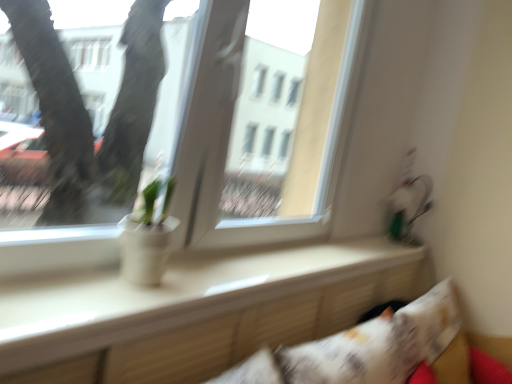
Question: Can you confirm if white matte pot at center is shorter than transparent glass window at center?

Choices:
 (A) yes
 (B) no

Answer: (A)

Question: Considering the relative sizes of white matte pot at center and transparent glass window at center in the image provided, is white matte pot at center wider than transparent glass window at center?

Choices:
 (A) no
 (B) yes

Answer: (A)

Question: Is white matte pot at center placed right next to transparent glass window at center?

Choices:
 (A) yes
 (B) no

Answer: (B)

Question: Is white matte pot at center at the left side of transparent glass window at center?

Choices:
 (A) no
 (B) yes

Answer: (B)

Question: Is white matte pot at center to the right of transparent glass window at center from the viewer's perspective?

Choices:
 (A) yes
 (B) no

Answer: (B)

Question: Can you confirm if white matte pot at center is taller than transparent glass window at center?

Choices:
 (A) yes
 (B) no

Answer: (B)

Question: Would you say white matte pot at center is outside white glossy window sill at center?

Choices:
 (A) no
 (B) yes

Answer: (B)

Question: Considering the relative positions of white matte pot at center and white glossy window sill at center in the image provided, is white matte pot at center behind white glossy window sill at center?

Choices:
 (A) yes
 (B) no

Answer: (A)

Question: Considering the relative sizes of white matte pot at center and white glossy window sill at center in the image provided, is white matte pot at center smaller than white glossy window sill at center?

Choices:
 (A) yes
 (B) no

Answer: (A)

Question: From a real-world perspective, is white matte pot at center beneath white glossy window sill at center?

Choices:
 (A) yes
 (B) no

Answer: (B)

Question: Would you say white glossy window sill at center is part of white matte pot at center's contents?

Choices:
 (A) no
 (B) yes

Answer: (A)

Question: From the image's perspective, is white matte pot at center beneath white glossy window sill at center?

Choices:
 (A) yes
 (B) no

Answer: (B)

Question: Does white printed pillow at lower right appear on the left side of white glossy window sill at center?

Choices:
 (A) yes
 (B) no

Answer: (B)